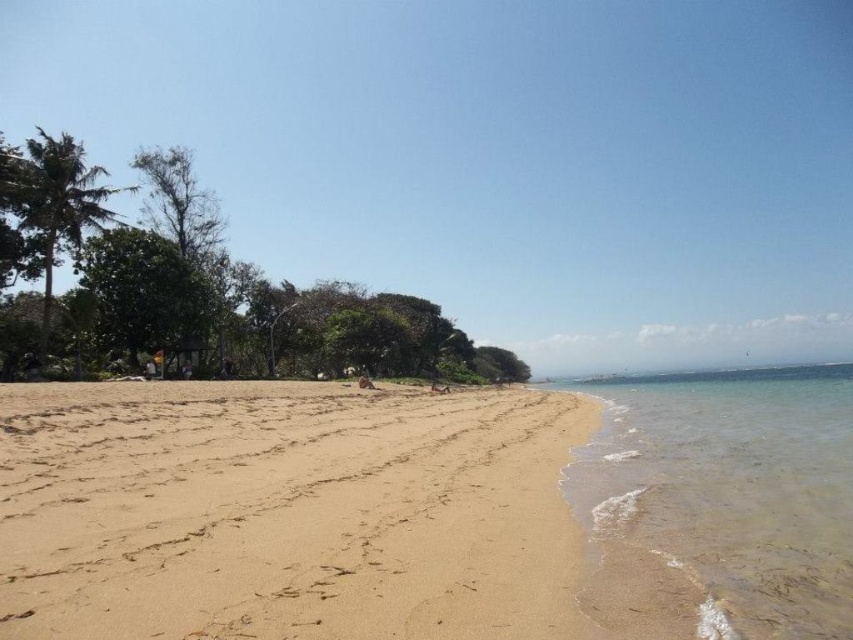
Question: Is light brown sand at center to the left of clear water at lower right from the viewer's perspective?

Choices:
 (A) yes
 (B) no

Answer: (A)

Question: Does light brown sand at center have a smaller size compared to clear water at lower right?

Choices:
 (A) no
 (B) yes

Answer: (B)

Question: Does light brown sand at center have a smaller size compared to clear water at lower right?

Choices:
 (A) yes
 (B) no

Answer: (A)